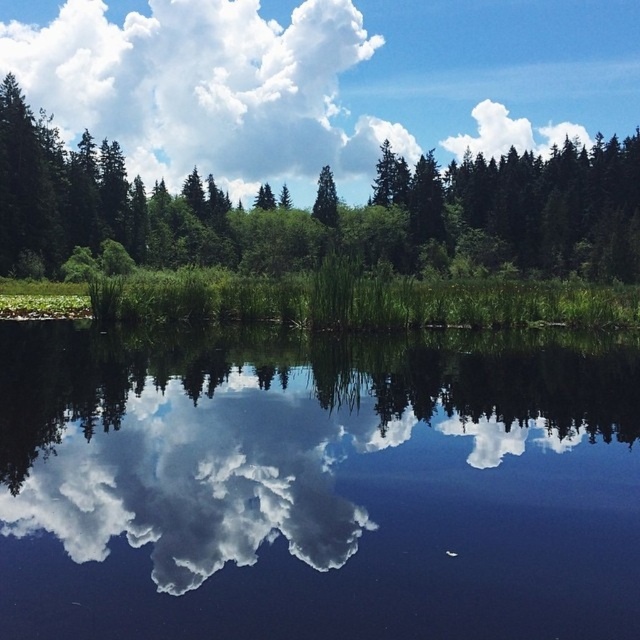
Question: Among these objects, which one is nearest to the camera?

Choices:
 (A) green matte tree at center
 (B) transparent water at center
 (C) green leafy trees at upper center

Answer: (B)

Question: Is transparent water at center wider than green leafy trees at upper center?

Choices:
 (A) no
 (B) yes

Answer: (A)

Question: Does transparent water at center lie in front of white fluffy cloud at upper center?

Choices:
 (A) yes
 (B) no

Answer: (A)

Question: Considering the relative positions of transparent water at center and green matte tree at center in the image provided, where is transparent water at center located with respect to green matte tree at center?

Choices:
 (A) left
 (B) right

Answer: (A)

Question: Which point is farther to the camera?

Choices:
 (A) (72, 33)
 (B) (60, 403)

Answer: (A)

Question: Considering the real-world distances, which object is farthest from the white fluffy cloud at upper center?

Choices:
 (A) transparent water at center
 (B) green leafy trees at upper center
 (C) green matte tree at center

Answer: (A)